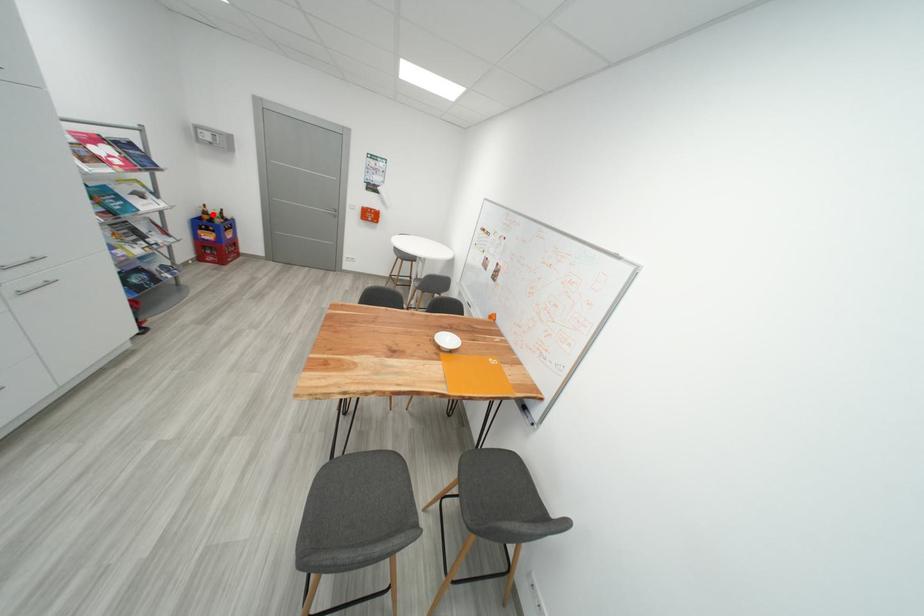
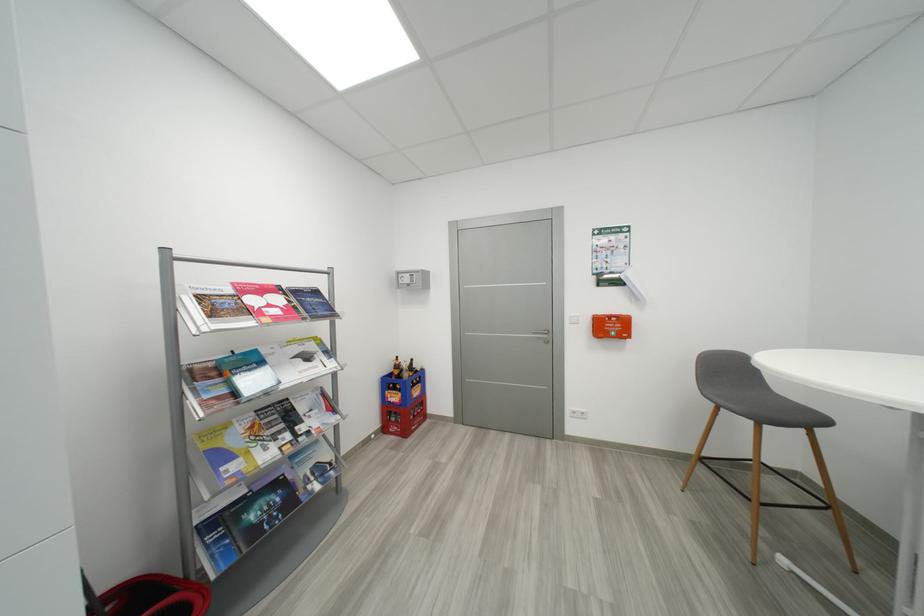
Find the pixel in the second image that matches the highlighted location in the first image.

(404, 369)